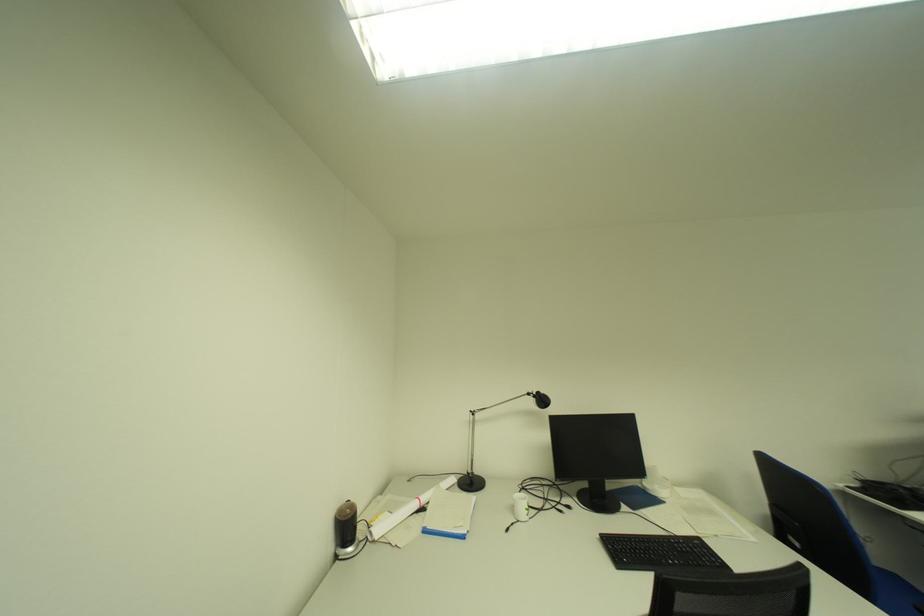
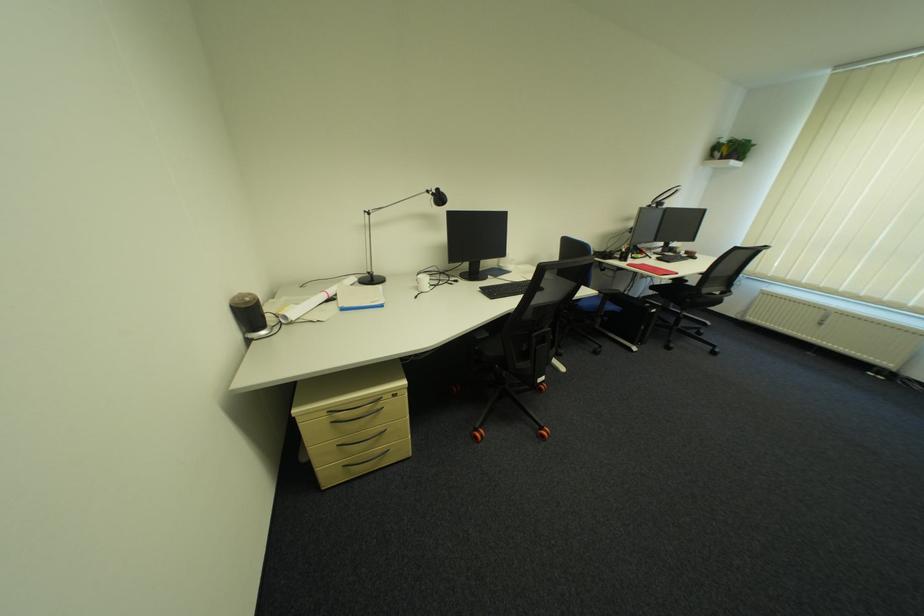
The point at [523,511] is marked in the first image. Where is the corresponding point in the second image?

(427, 288)